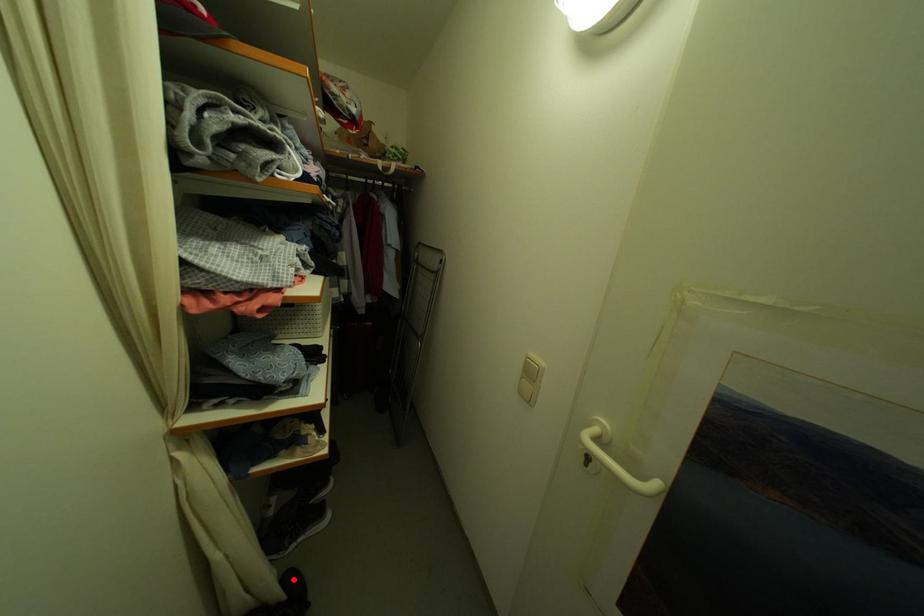
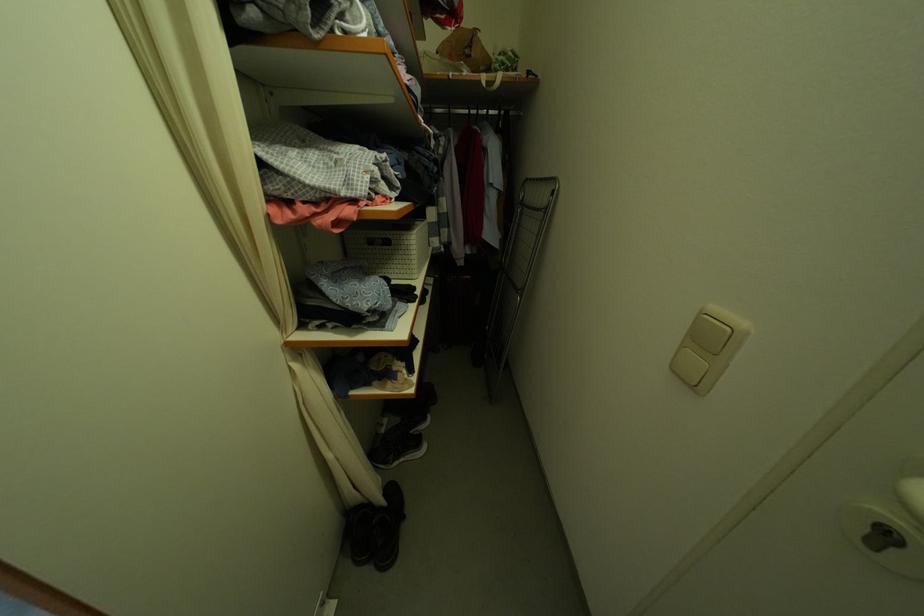
Where in the second image is the point corresponding to the highlighted location from the first image?

(395, 490)